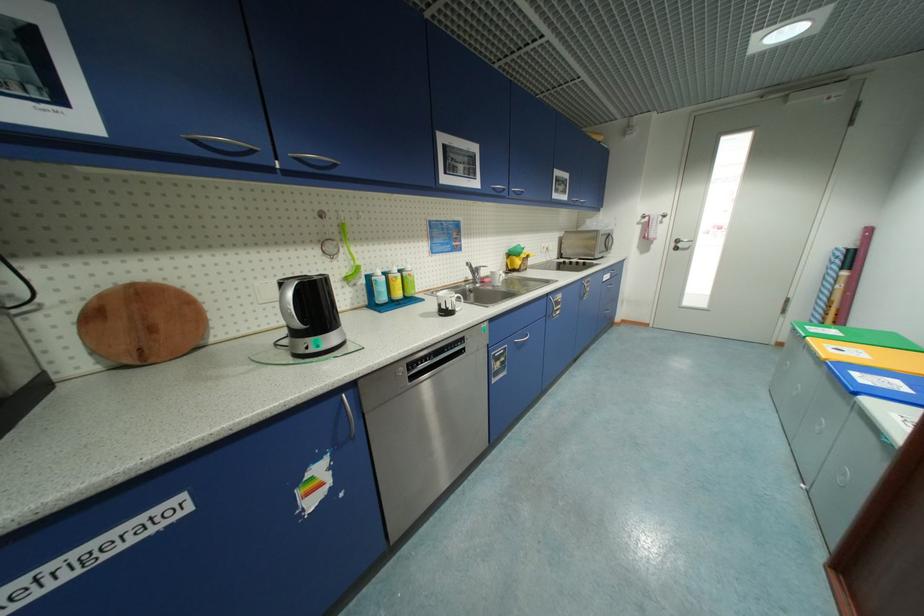
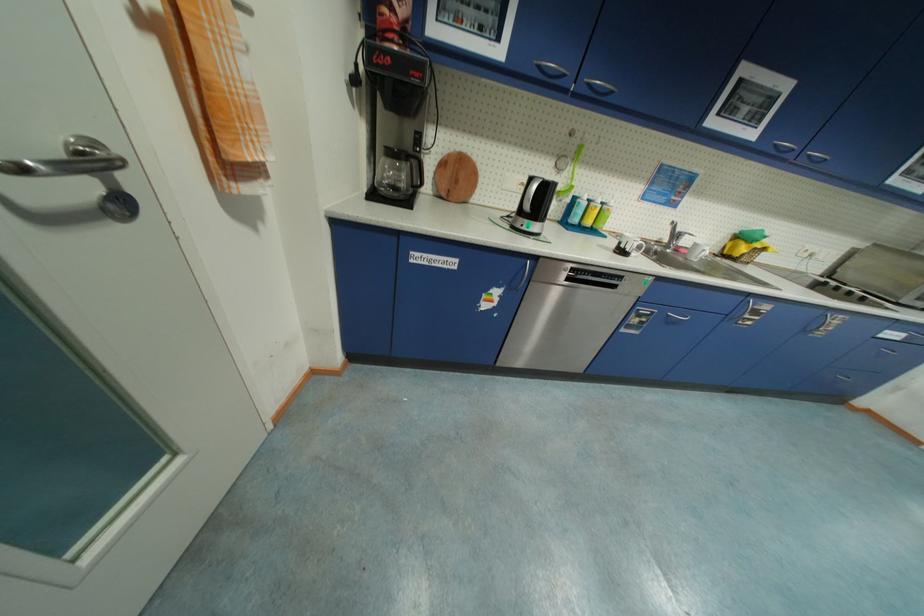
Where in the second image is the point corresponding to [448,308] from the first image?

(627, 246)